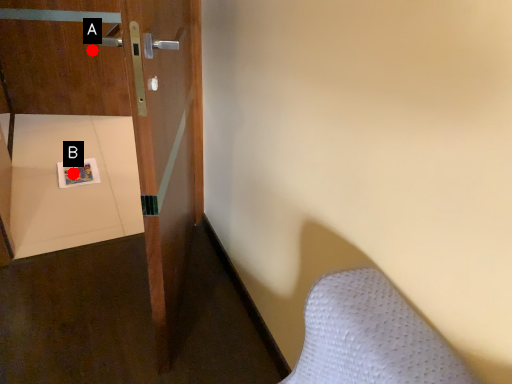
Question: Two points are circled on the image, labeled by A and B beside each circle. Which point is closer to the camera taking this photo?

Choices:
 (A) A is closer
 (B) B is closer

Answer: (B)